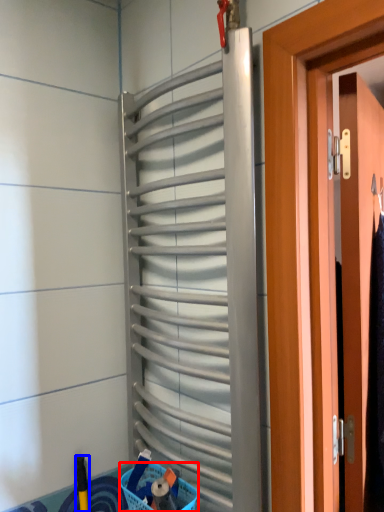
Question: Which point is further to the camera, basket (highlighted by a red box) or brush (highlighted by a blue box)?

Choices:
 (A) basket
 (B) brush

Answer: (B)